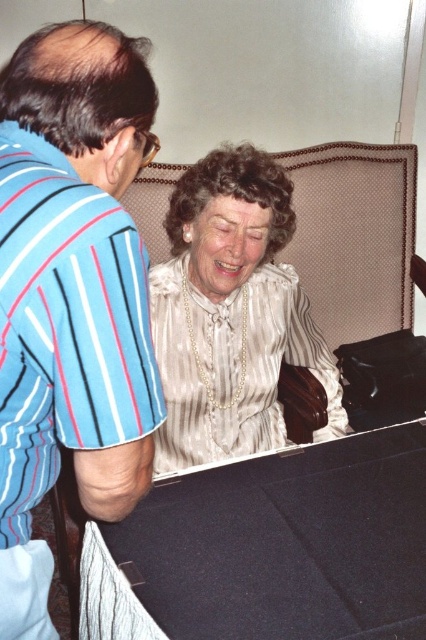
Question: Does black felt table at lower center appear over white satin blouse at center?

Choices:
 (A) yes
 (B) no

Answer: (B)

Question: In this image, where is blue striped shirt at left located relative to black felt table at lower center?

Choices:
 (A) left
 (B) right

Answer: (A)

Question: Estimate the real-world distances between objects in this image. Which object is closer to the white satin blouse at center?

Choices:
 (A) black felt table at lower center
 (B) blue striped shirt at left

Answer: (A)

Question: Which point appears closest to the camera in this image?

Choices:
 (A) (54, 461)
 (B) (164, 634)

Answer: (A)

Question: Which of the following is the closest to the observer?

Choices:
 (A) white satin blouse at center
 (B) blue striped shirt at left
 (C) black felt table at lower center

Answer: (B)

Question: Is blue striped shirt at left bigger than black felt table at lower center?

Choices:
 (A) yes
 (B) no

Answer: (B)